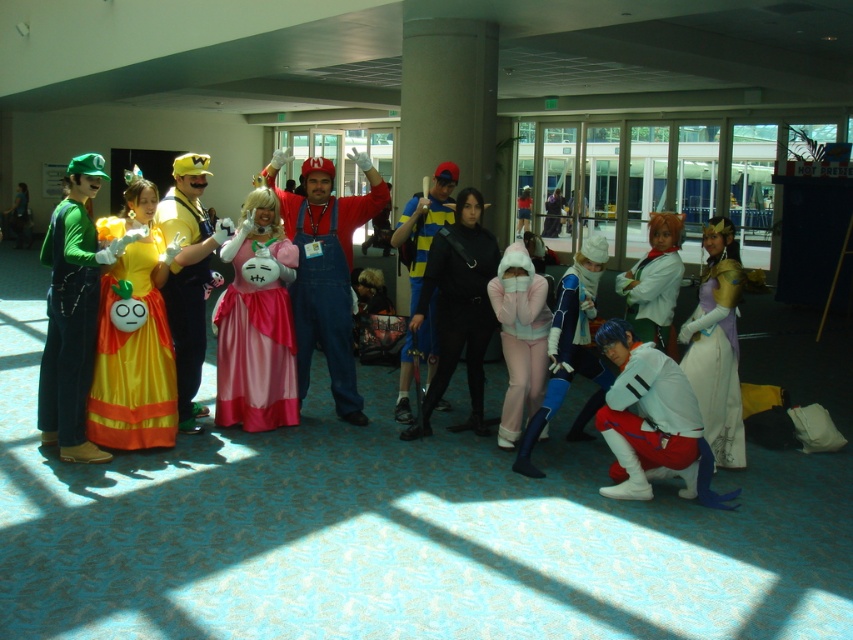
You are a photographer trying to capture a group photo of the pink satin dress at center and the white satin dress at center. The camera you are using has a maximum focus range of 2.5 meters. Will you be able to capture both dresses in focus at the same time?

The pink satin dress at center and white satin dress at center are 2.76 meters apart from each other. Since the camera can only focus up to 2.5 meters, it won

You are standing at the entrance of the convention hall and see the group of people in costumes. There is a point marked at coordinates (256, 333). Which costume does this point belong to?

The point at coordinates (256, 333) is on the pink satin dress at center.